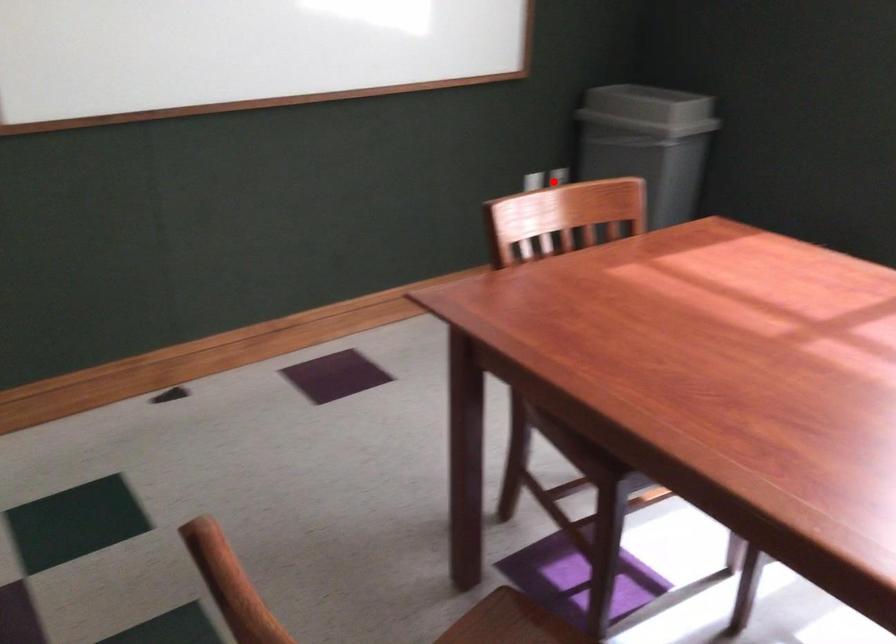
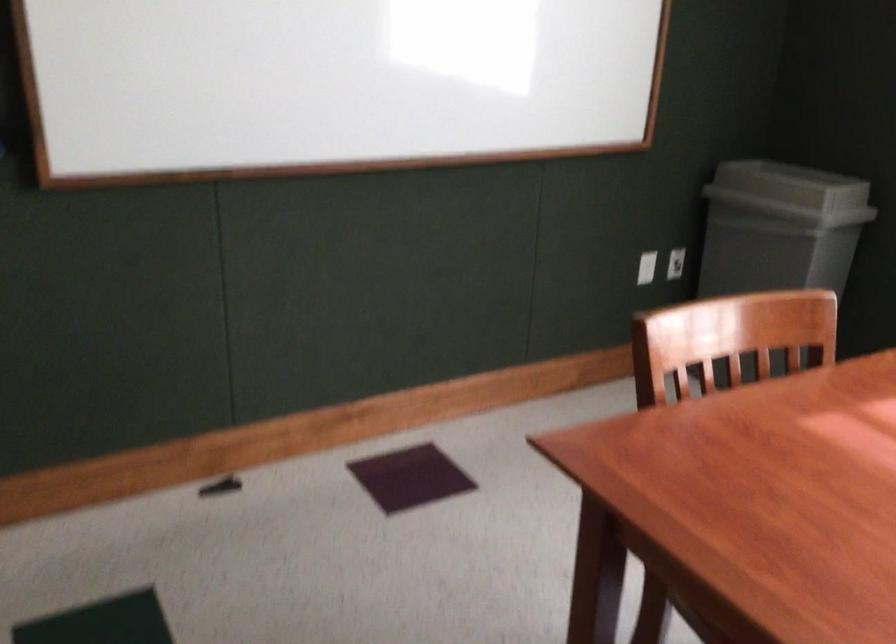
The point at the highlighted location is marked in the first image. Where is the corresponding point in the second image?

(675, 263)